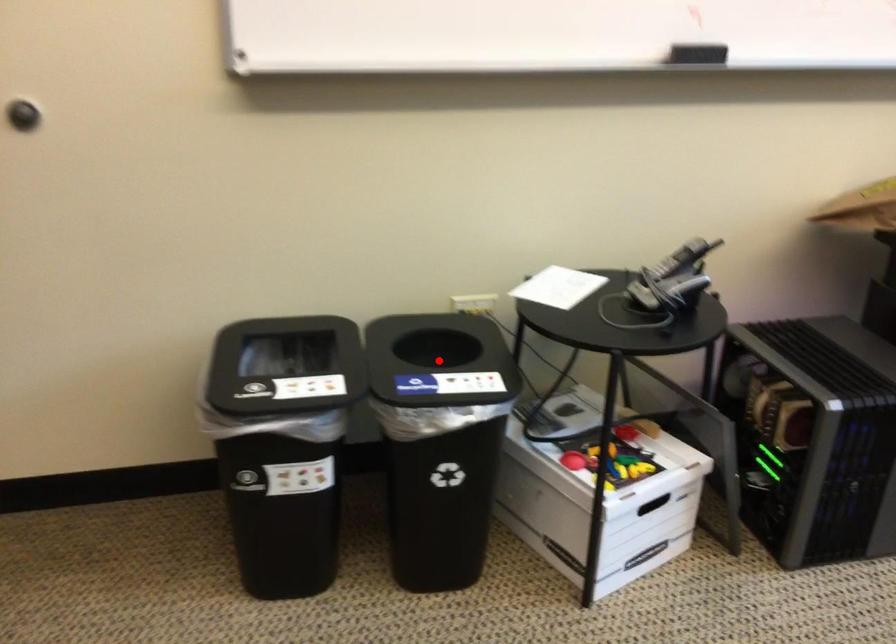
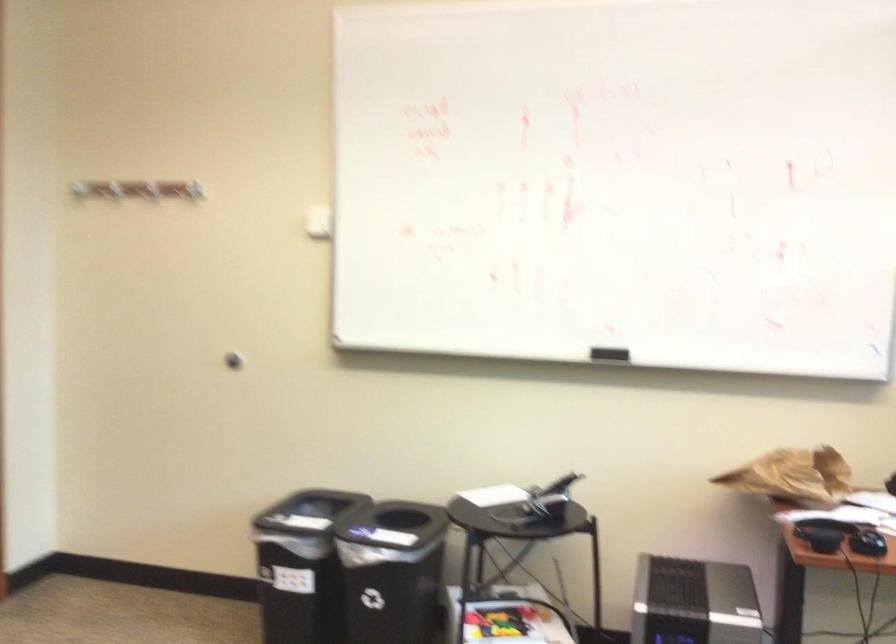
Question: I am providing you with two images of the same scene from different viewpoints. In image1, a red point is highlighted. Considering the same 3D point in image2, which of the following is correct?

Choices:
 (A) It is closer
 (B) It is farther

Answer: (B)